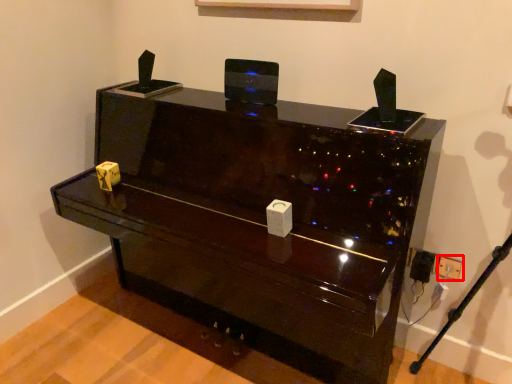
Question: Where is electric outlet (annotated by the red box) located in relation to furniture in the image?

Choices:
 (A) left
 (B) right

Answer: (B)